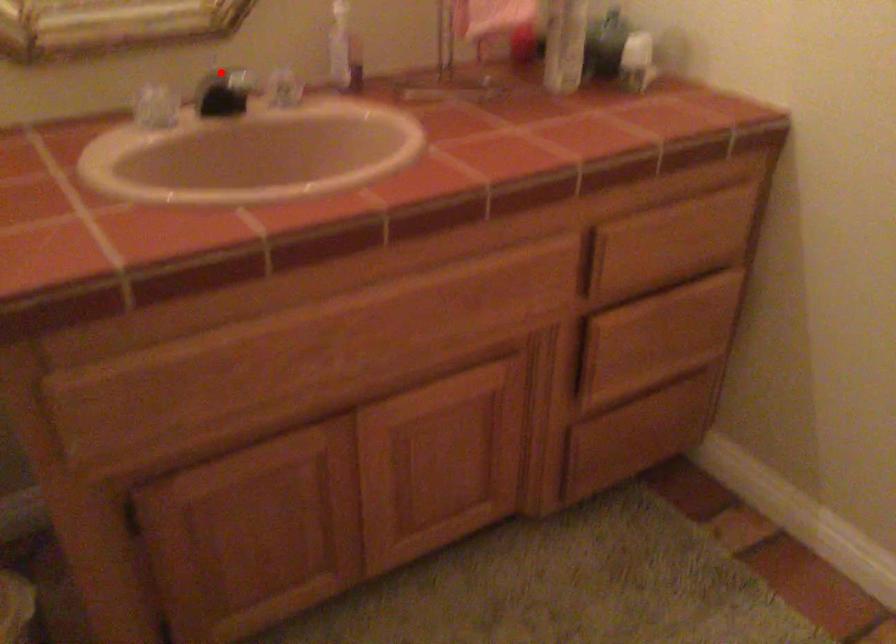
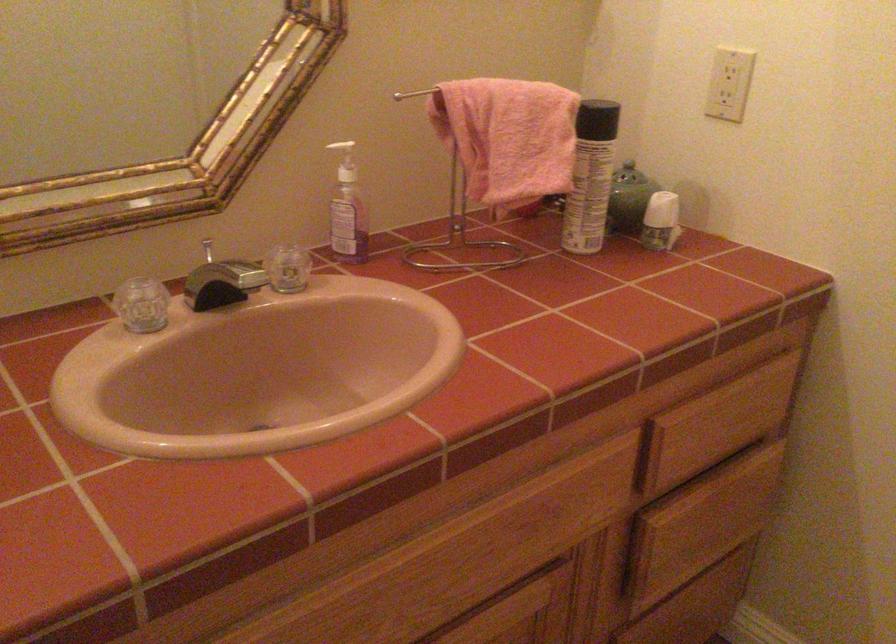
Question: I am providing you with two images of the same scene from different viewpoints. Given a red point in image1, look at the same physical point in image2. Is it:

Choices:
 (A) Closer to the viewpoint
 (B) Farther from the viewpoint

Answer: (A)